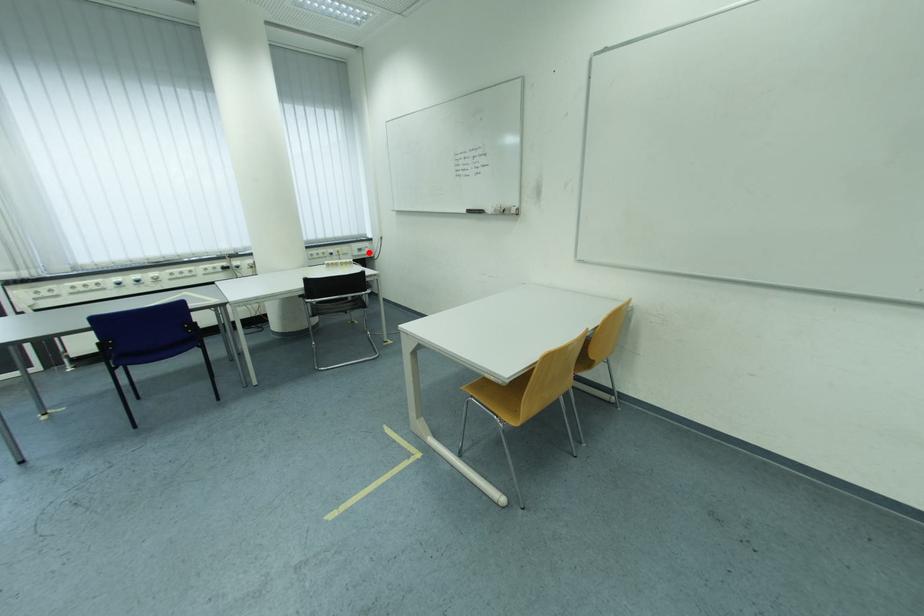
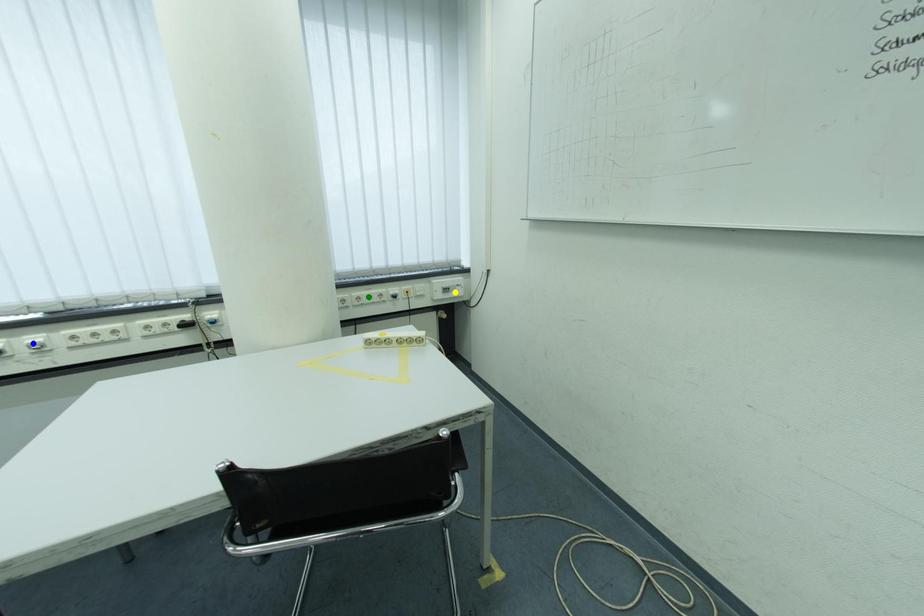
Question: I am providing you with two images of the same scene from different viewpoints. A red point is marked on the first image. You are given multiple points on the second image. Can you choose the point in image 2 that corresponds to the point in image 1?

Choices:
 (A) blue point
 (B) green point
 (C) yellow point

Answer: (C)